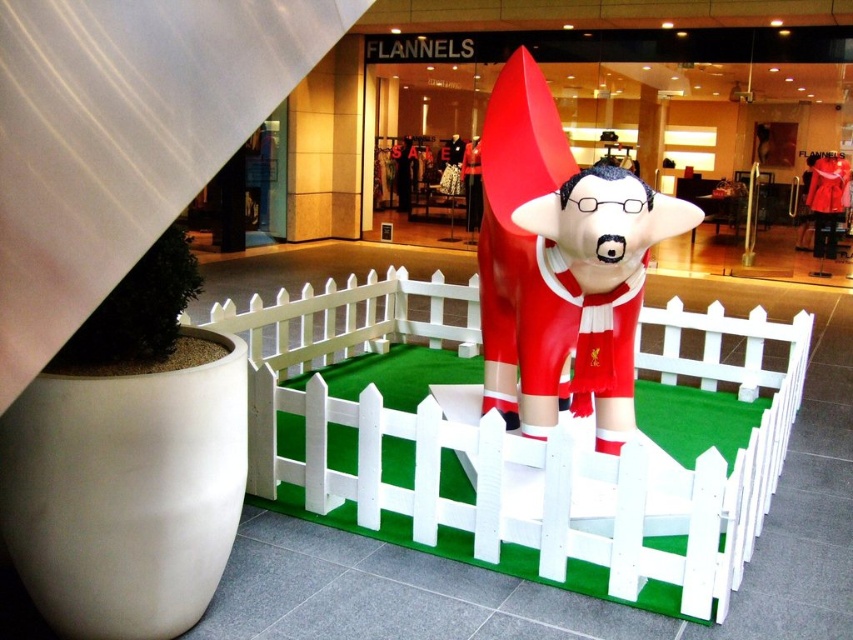
Does white plastic fence at center appear under shiny red statue at center?

Correct, white plastic fence at center is located below shiny red statue at center.

Between point (524, 529) and point (511, 392), which one is positioned in front?

Positioned in front is point (524, 529).

Which is behind, point (750, 385) or point (546, 186)?

The point (750, 385) is behind.

Image resolution: width=853 pixels, height=640 pixels. Identify the location of white plastic fence at center. (519, 436).